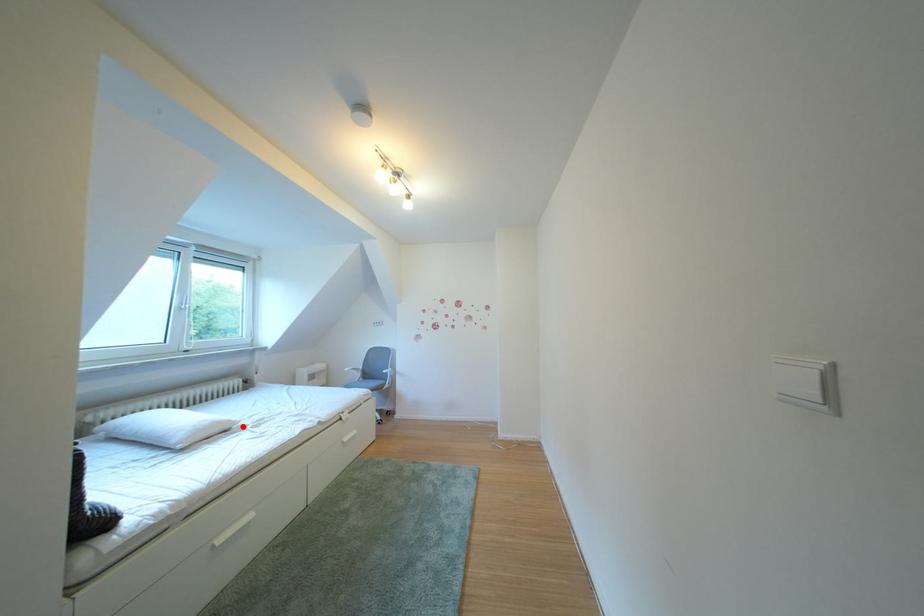
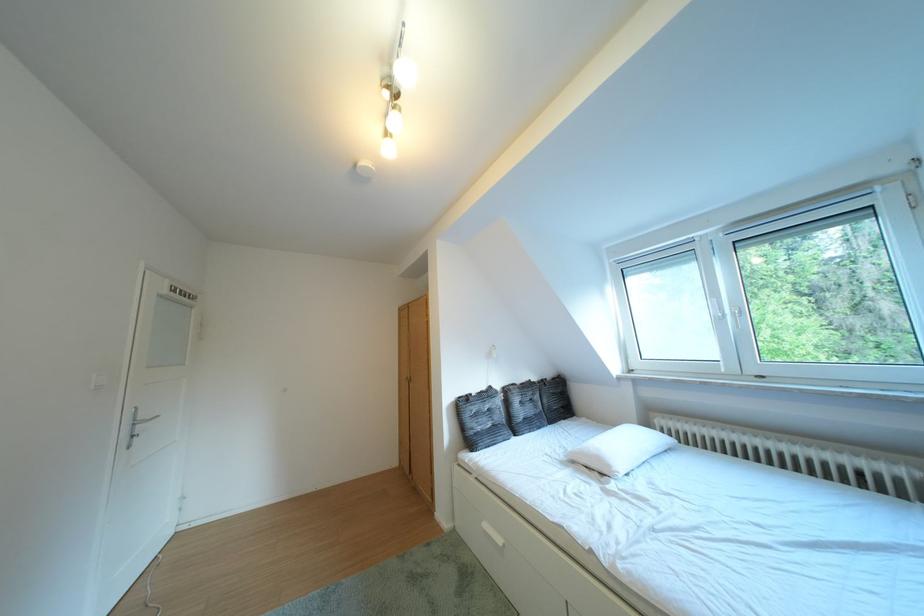
Question: I am providing you with two images of the same scene from different viewpoints. In image1, a red point is highlighted. Considering the same 3D point in image2, which of the following is correct?

Choices:
 (A) It is closer
 (B) It is farther

Answer: (B)